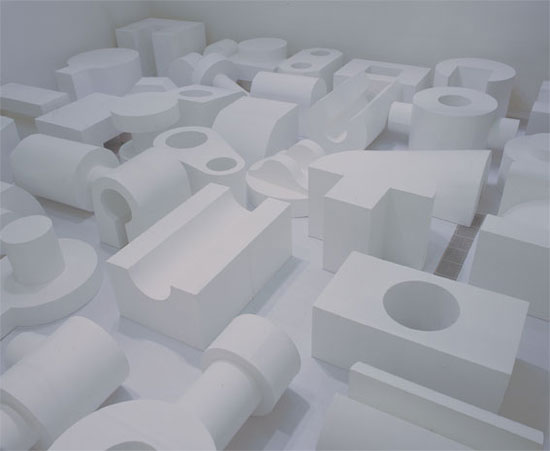
This screenshot has width=550, height=451. Find the location of `floor`. floor is located at coordinates (302, 282).